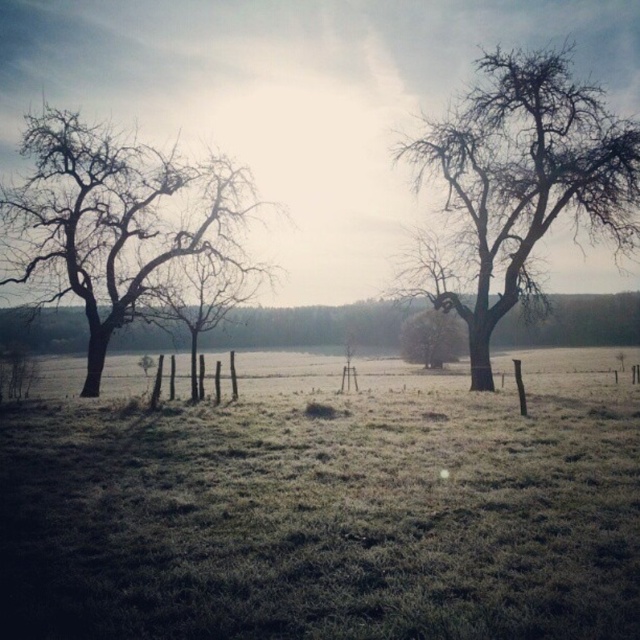
From the picture: You are standing in the rural landscape and want to walk from the point closer to you to the point further away. Which path would you take between the two points, point (102, 134) and point (577, 134)?

You should walk from point (102, 134) to point (577, 134) because point (102, 134) is closer to you and point (577, 134) is further away.

You are standing at the center of the field and want to take a photo of the bare wood tree at upper right. According to the coordinates provided, in which direction should you point your camera to capture the tree in the frame?

The bare wood tree at upper right is located at coordinates point [525,179]. Since you are at the center of the field, you should point your camera towards the upper right direction to capture the tree in the frame.

You are an artist sketching the rural landscape scene. You want to draw the bare branches at left and the bare wood tree at upper right. Which one should you draw first to maintain proper perspective?

You should draw the bare wood tree at upper right first because it is smaller and farther away, while the bare branches at left are larger and closer, so starting with the distant tree establishes the background before adding closer elements.